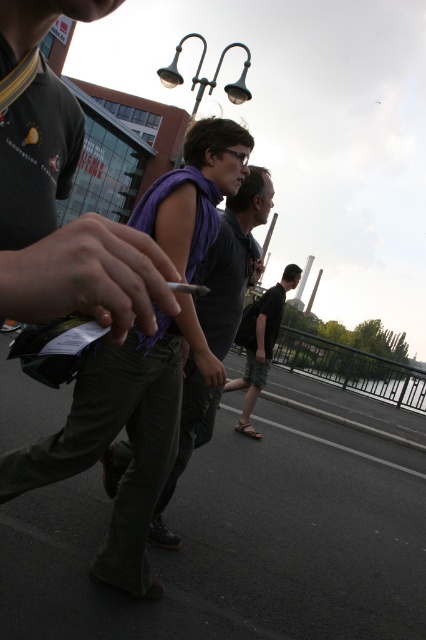
You are a photographer trying to capture the purple scarf at center in your shot. Given that your camera has a focal point at coordinates 0.5, 0.5, will the scarf be in focus?

The purple scarf at center is located at coordinates [233,260], which is close to the camera focal point at [213,320]. Therefore, the scarf will be in focus.

You are standing at the point marked as point (259, 342) in the image. What clothing item is located exactly at that point?

The black cotton shorts at center are located exactly at point (259, 342).

You are standing at the point closer to the camera between the two points, point (x=187, y=440) and point (x=186, y=282). Which point are you standing at?

You are standing at point (x=187, y=440) because it is further to the camera than point (x=186, y=282).